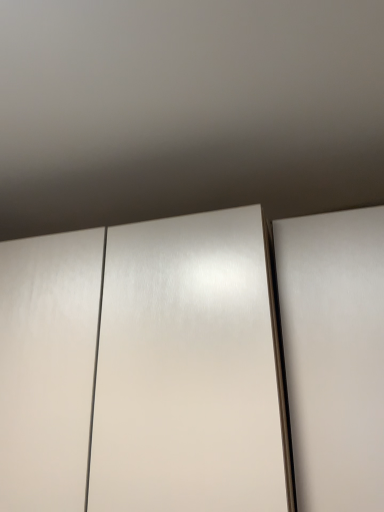
In order to face white glossy cupboard at center, should I rotate leftwards or rightwards?

To align with it, rotate left about 8.399°.

Describe the element at coordinates (195, 365) in the screenshot. The height and width of the screenshot is (512, 384). I see `white glossy cupboard at center` at that location.

Find the location of a particular element. This screenshot has width=384, height=512. white glossy cupboard at center is located at coordinates (195, 365).

Find the location of a particular element. The image size is (384, 512). white glossy cupboard at center is located at coordinates (195, 365).